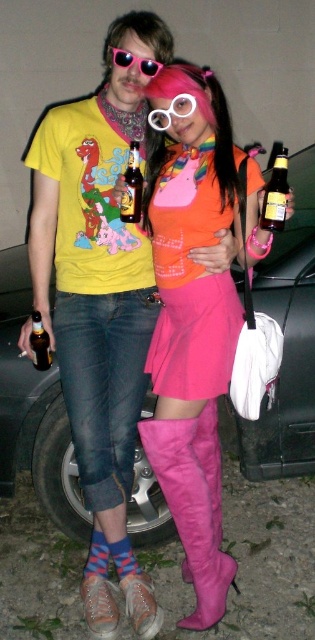
Does brown glass bottle at center have a greater width compared to pink rubber goggles at center?

No.

Is brown glass bottle at center to the left of pink rubber goggles at center from the viewer's perspective?

Indeed, brown glass bottle at center is positioned on the left side of pink rubber goggles at center.

This screenshot has width=315, height=640. I want to click on brown glass bottle at center, so click(x=131, y=186).

Where is `pink suede boots at lower center`? This screenshot has height=640, width=315. pink suede boots at lower center is located at coordinates (193, 324).

Describe the element at coordinates (193, 324) in the screenshot. The image size is (315, 640). I see `pink suede boots at lower center` at that location.

Find the location of a particular element. pink suede boots at lower center is located at coordinates (193, 324).

Does pink suede boot at lower center have a smaller size compared to translucent glass bottle at lower left?

Incorrect, pink suede boot at lower center is not smaller in size than translucent glass bottle at lower left.

Does pink suede boot at lower center come behind translucent glass bottle at lower left?

No.

This screenshot has height=640, width=315. I want to click on pink suede boot at lower center, so click(x=189, y=515).

Identify the location of pink suede boot at lower center. Image resolution: width=315 pixels, height=640 pixels. (189, 515).